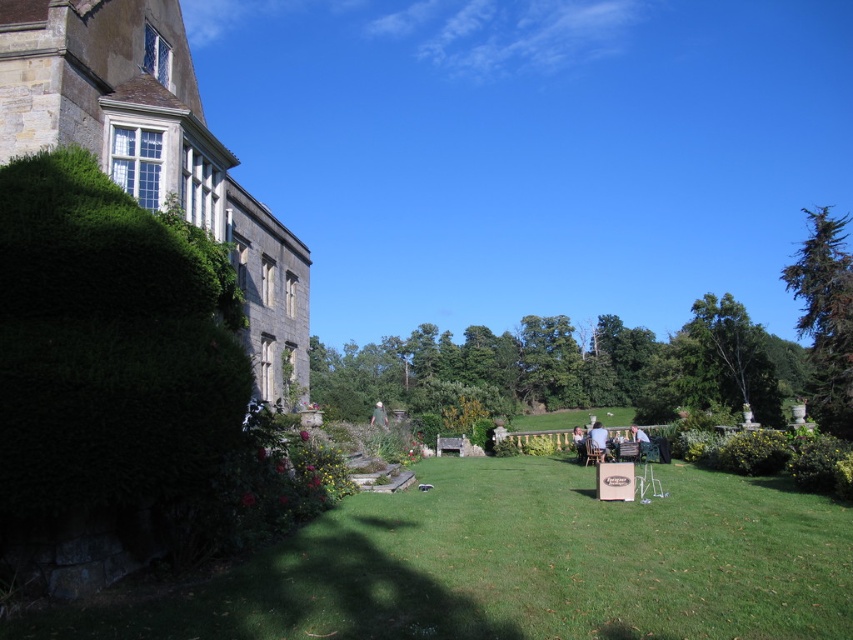
Who is more forward, [601,422] or [647,456]?

Point [647,456]

Is the position of light blue fabric chair at center more distant than that of green fabric chair at lower right?

Yes, it is behind green fabric chair at lower right.

Does point (596, 433) come farther from viewer compared to point (642, 436)?

No.

You are a GUI agent. You are given a task and a screenshot of the screen. Output one action in this format:
    pyautogui.click(x=<x>, y=<y>)
    Task: Click on the light blue fabric chair at center
    The width and height of the screenshot is (853, 640).
    Given the screenshot: What is the action you would take?
    pyautogui.click(x=598, y=438)